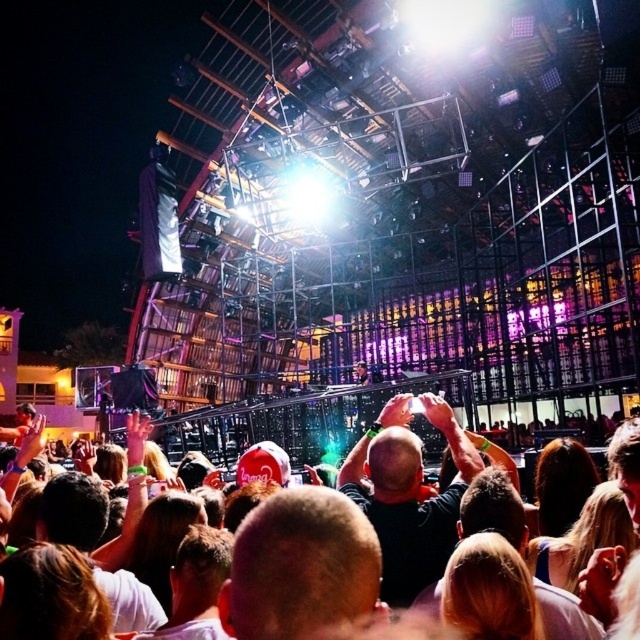
Question: Is dark gray shirt at center positioned in front of white cloth crowd at center?

Choices:
 (A) no
 (B) yes

Answer: (A)

Question: Among these objects, which one is nearest to the camera?

Choices:
 (A) white cloth crowd at center
 (B) dark gray shirt at center

Answer: (A)

Question: Can you confirm if dark gray shirt at center is positioned to the right of white cloth crowd at center?

Choices:
 (A) yes
 (B) no

Answer: (A)

Question: Where is dark gray shirt at center located in relation to white cloth crowd at center in the image?

Choices:
 (A) below
 (B) above

Answer: (A)